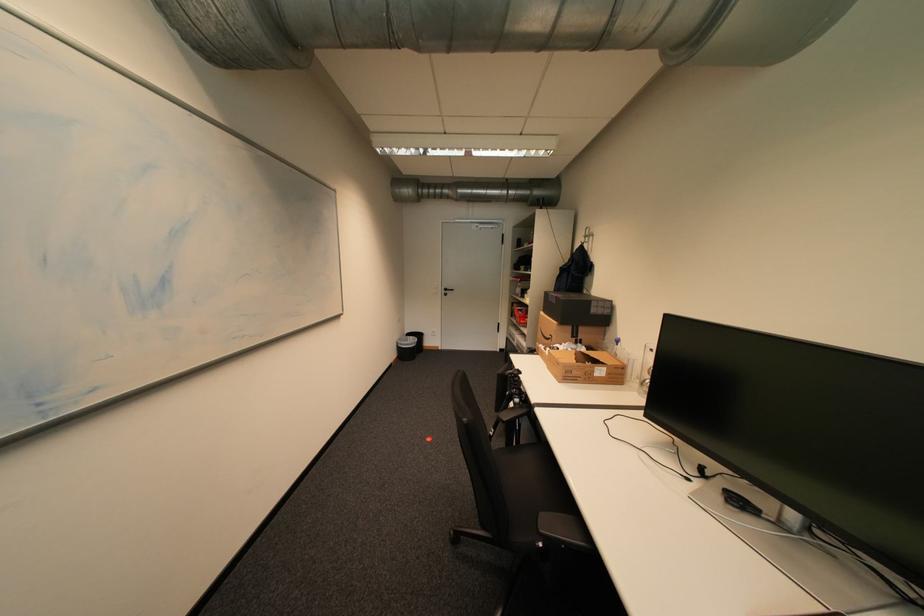
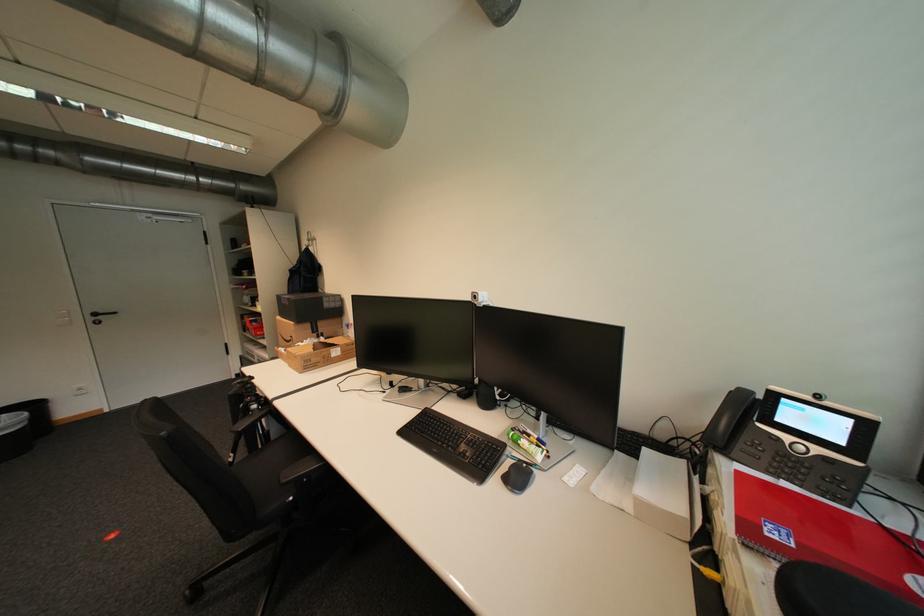
Locate, in the second image, the point that corresponds to point 523,445 in the first image.

(269, 448)